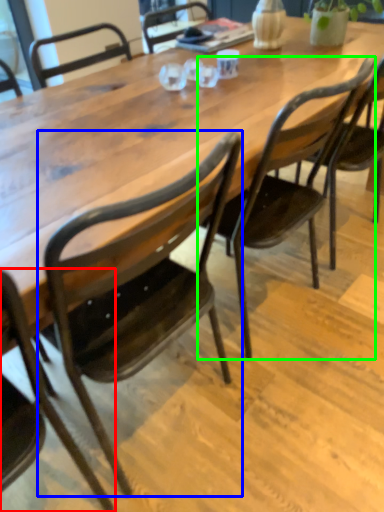
Question: Considering the real-world distances, which object is farthest from chair (highlighted by a red box)? chair (highlighted by a blue box) or chair (highlighted by a green box)?

Choices:
 (A) chair
 (B) chair

Answer: (B)